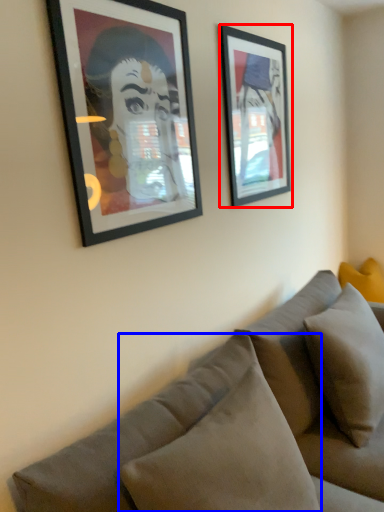
Question: Which object is closer to the camera taking this photo, picture frame (highlighted by a red box) or pillow (highlighted by a blue box)?

Choices:
 (A) picture frame
 (B) pillow

Answer: (B)